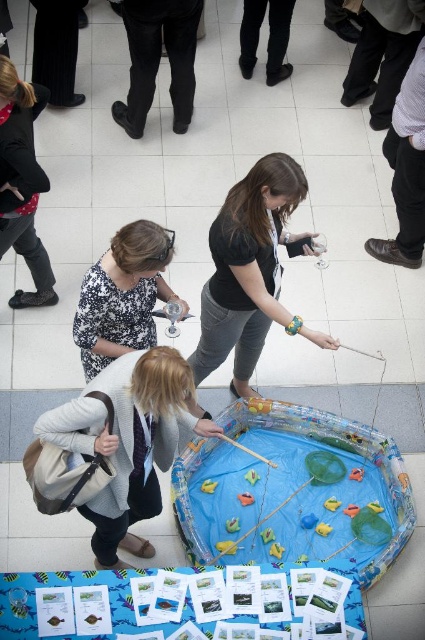
Can you confirm if black matte shirt at center is shorter than brown leather shoe at lower right?

Correct, black matte shirt at center is not as tall as brown leather shoe at lower right.

Does black matte shirt at center have a larger size compared to brown leather shoe at lower right?

Correct, black matte shirt at center is larger in size than brown leather shoe at lower right.

Image resolution: width=425 pixels, height=640 pixels. What do you see at coordinates (251, 272) in the screenshot?
I see `black matte shirt at center` at bounding box center [251, 272].

Image resolution: width=425 pixels, height=640 pixels. I want to click on black matte shirt at center, so click(251, 272).

In the scene shown: Which is more to the left, matte black shirt at upper left or black leather shoes at upper center?

From the viewer's perspective, matte black shirt at upper left appears more on the left side.

What do you see at coordinates (22, 182) in the screenshot? The image size is (425, 640). I see `matte black shirt at upper left` at bounding box center [22, 182].

Is point (16, 179) more distant than point (254, 38)?

No, it is not.

You are a GUI agent. You are given a task and a screenshot of the screen. Output one action in this format:
    pyautogui.click(x=<x>, y=<y>)
    Task: Click on the matte black shirt at upper left
    
    Given the screenshot: What is the action you would take?
    pyautogui.click(x=22, y=182)

Can you confirm if light gray sweater at center is smaller than matte black shirt at upper left?

Actually, light gray sweater at center might be larger than matte black shirt at upper left.

This screenshot has height=640, width=425. Describe the element at coordinates (129, 440) in the screenshot. I see `light gray sweater at center` at that location.

Who is more distant from viewer, (172, 436) or (45, 182)?

Positioned behind is point (45, 182).

Identify the location of light gray sweater at center. The width and height of the screenshot is (425, 640). (129, 440).